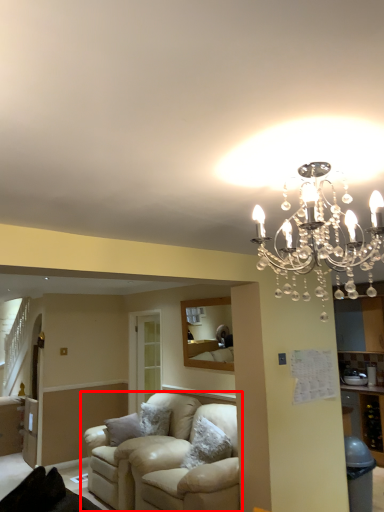
Question: From the image's perspective, where is studio couch (annotated by the red box) located in relation to lamp in the image?

Choices:
 (A) above
 (B) below

Answer: (B)